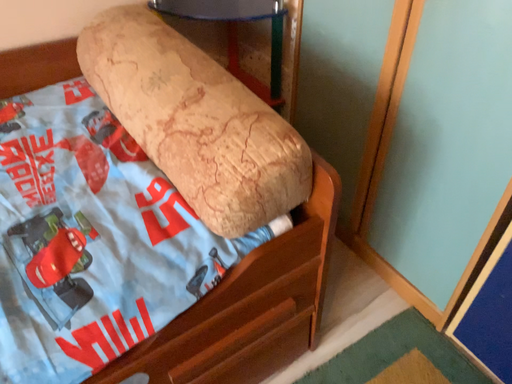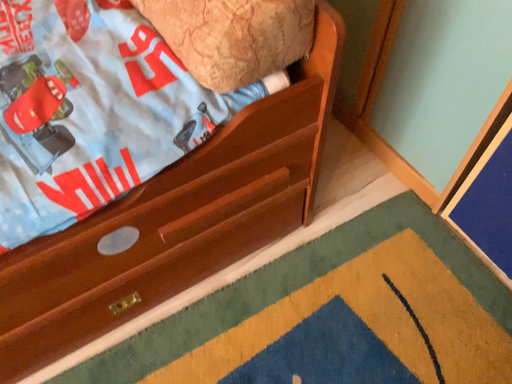
Question: Which way did the camera rotate in the video?

Choices:
 (A) rotated upward
 (B) rotated downward

Answer: (B)